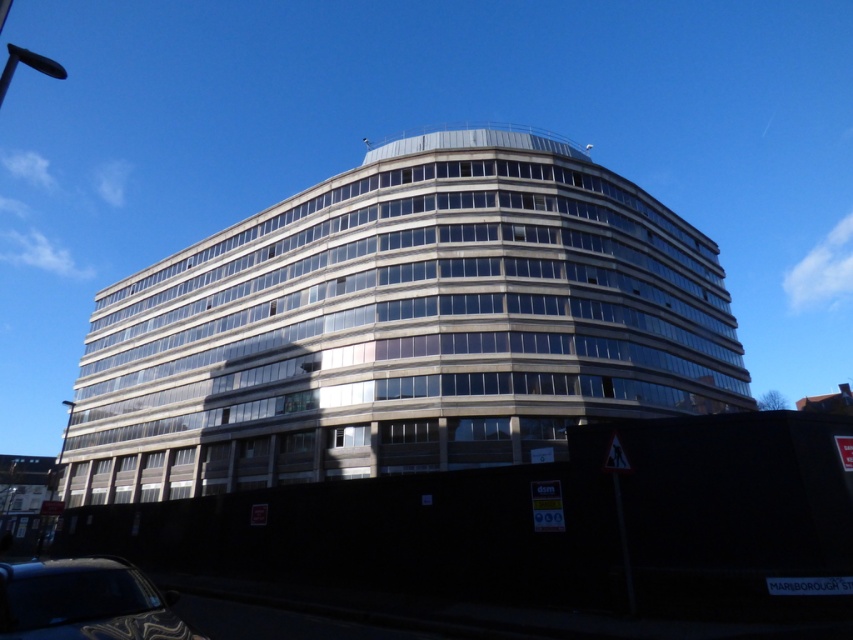
Does white concrete building at center have a greater width compared to shiny black car at lower left?

Yes, white concrete building at center is wider than shiny black car at lower left.

Is point (331, 422) closer to camera compared to point (49, 632)?

No.

I want to click on white concrete building at center, so click(410, 326).